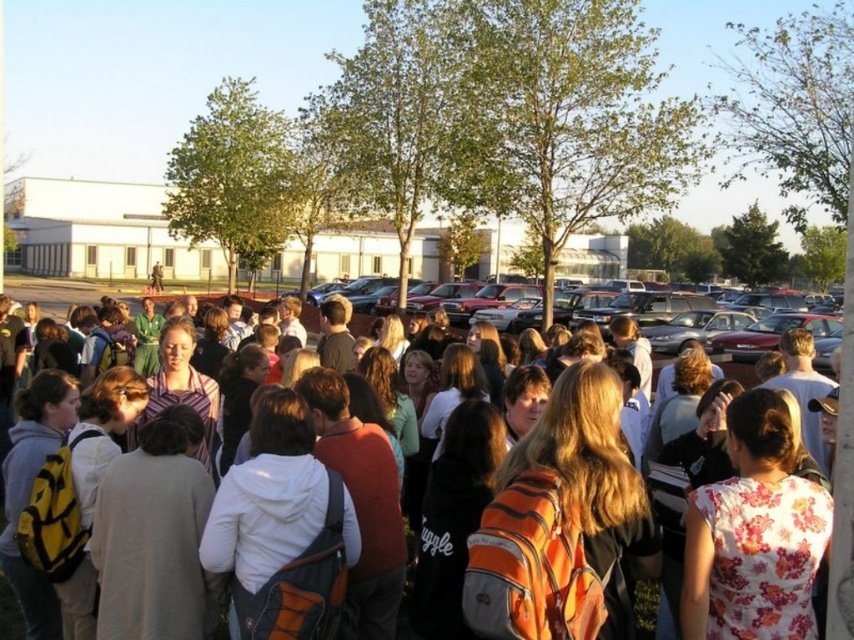
Question: Does metallic silver sedan at center appear on the left side of orange backpack at center?

Choices:
 (A) no
 (B) yes

Answer: (A)

Question: Can you confirm if metallic silver sedan at center is positioned above orange backpack at center?

Choices:
 (A) no
 (B) yes

Answer: (B)

Question: Which object appears closest to the camera in this image?

Choices:
 (A) metallic silver sedan at center
 (B) orange backpack at center

Answer: (B)

Question: Considering the relative positions of metallic silver sedan at center and orange backpack at center in the image provided, where is metallic silver sedan at center located with respect to orange backpack at center?

Choices:
 (A) right
 (B) left

Answer: (A)

Question: Which point appears closest to the camera in this image?

Choices:
 (A) click(658, 360)
 (B) click(607, 337)

Answer: (A)

Question: Among these points, which one is farthest from the camera?

Choices:
 (A) (648, 324)
 (B) (654, 372)

Answer: (A)